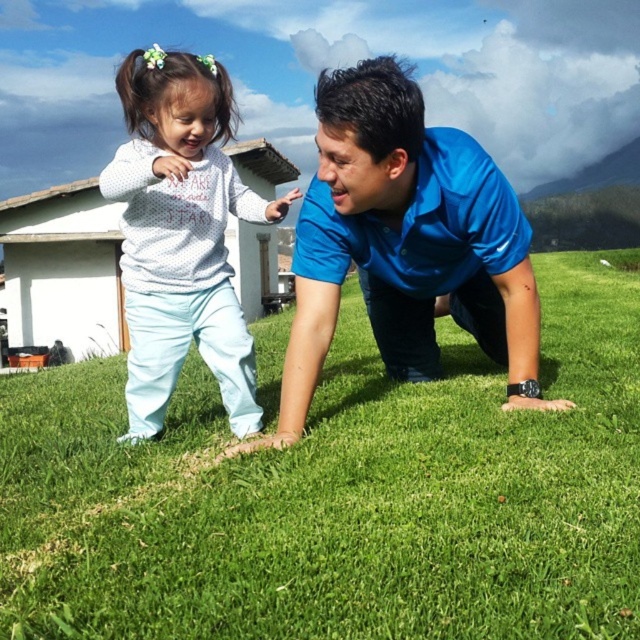
Based on the photo, you are a photographer trying to capture a closeup of the blue smooth shirt at center and the white dotted sweater at upper left. Since you can only focus on one object at a time, which one should you choose to ensure it fills more of your camera frame?

The blue smooth shirt at center is larger in size than the white dotted sweater at upper left, so choosing the blue smooth shirt at center will fill more of the camera frame.

You are a photographer trying to capture a photo of the blue smooth shirt at center and the white dotted sweater at upper left. Which object is located to the right of the other?

The blue smooth shirt at center is positioned on the right side of white dotted sweater at upper left.

You are a photographer trying to capture a clear shot of both the blue smooth shirt at center and the white dotted sweater at upper left. Which object should you focus on first to ensure both are in focus?

You should focus on the blue smooth shirt at center first because it is closer to the camera than the white dotted sweater at upper left, so focusing on it will ensure both are in focus.